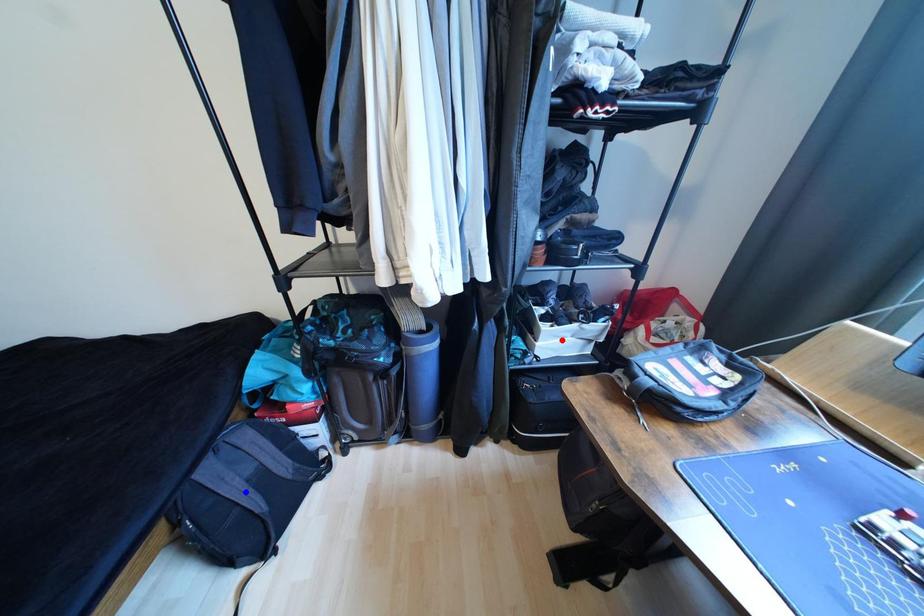
Question: Which of the two points in the image is closer to the camera?

Choices:
 (A) Blue point is closer.
 (B) Red point is closer.

Answer: (A)